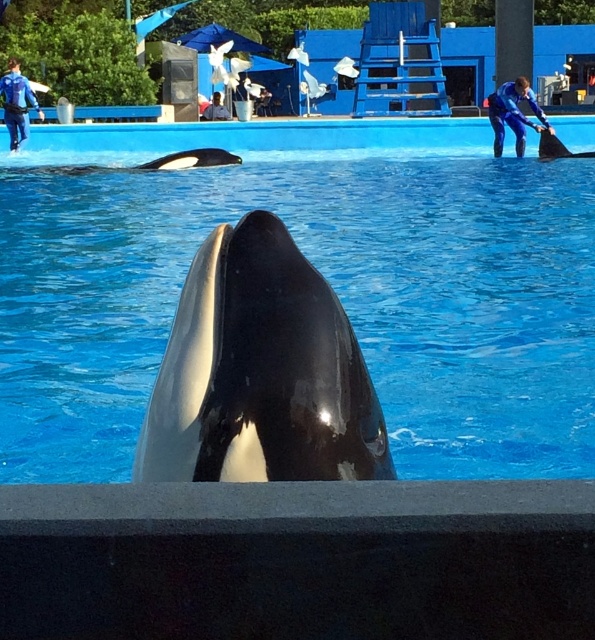
Who is positioned more to the left, black glossy whale at center or black smooth orca at center?

From the viewer's perspective, black smooth orca at center appears more on the left side.

Between black glossy whale at center and black smooth orca at center, which one has more height?

black glossy whale at center is taller.

What do you see at coordinates (261, 372) in the screenshot?
I see `black glossy whale at center` at bounding box center [261, 372].

Where is `black glossy whale at center`? Image resolution: width=595 pixels, height=640 pixels. black glossy whale at center is located at coordinates (261, 372).

Is point (371, 436) positioned behind point (515, 106)?

That is False.

Between point (242, 314) and point (502, 102), which one is positioned behind?

Positioned behind is point (502, 102).

Find the location of a particular element. The image size is (595, 640). black glossy whale at center is located at coordinates (261, 372).

Who is taller, blue smooth water at center or black glossy whale at center?

blue smooth water at center

Where is `blue smooth water at center`? The width and height of the screenshot is (595, 640). blue smooth water at center is located at coordinates (320, 272).